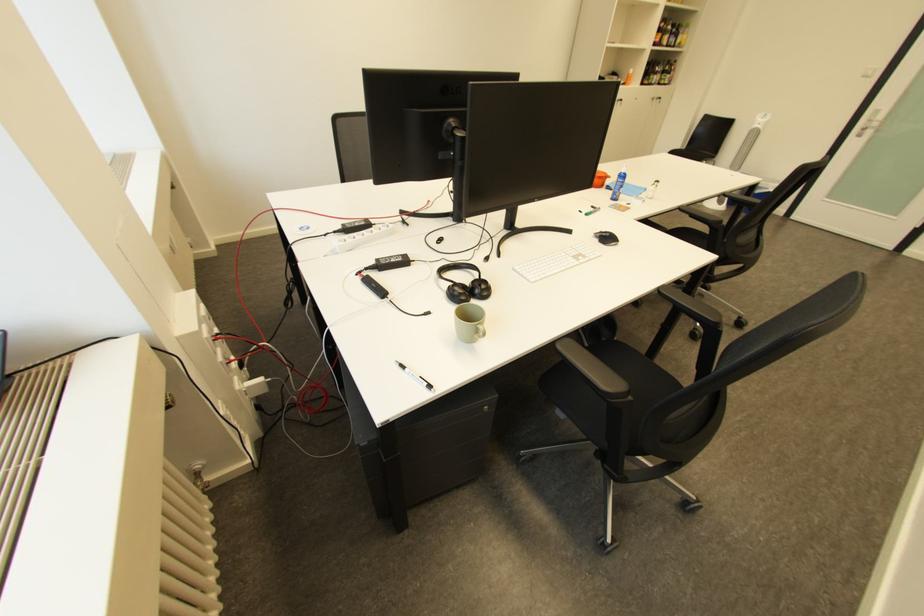
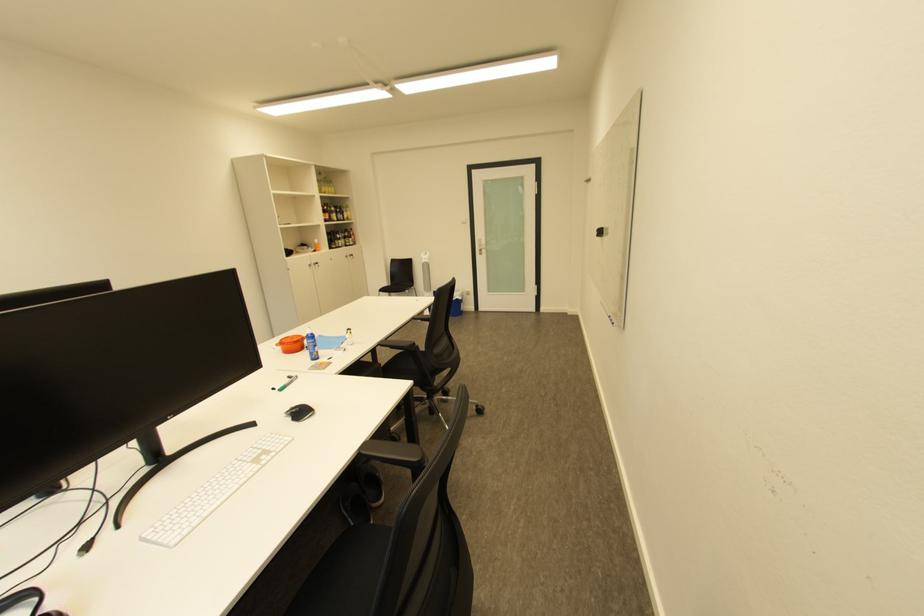
Where in the second image is the point corresponding to the point at 690,209 from the first image?

(391, 345)